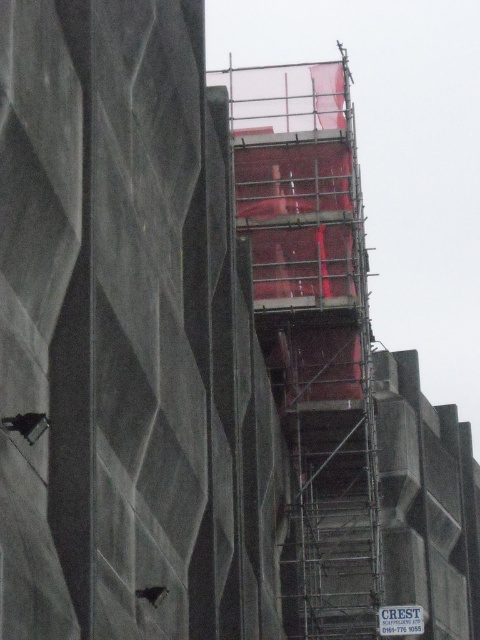
Question: Among these points, which one is nearest to the camera?

Choices:
 (A) (392, 609)
 (B) (279, 172)

Answer: (A)

Question: Which point is farther from the camera taking this photo?

Choices:
 (A) (265, 84)
 (B) (387, 630)

Answer: (A)

Question: Can you confirm if metallic scaffolding at center is positioned above blue plastic sign at upper center?

Choices:
 (A) yes
 (B) no

Answer: (A)

Question: Among these points, which one is farthest from the camera?

Choices:
 (A) (380, 632)
 (B) (288, 372)

Answer: (B)

Question: Is metallic scaffolding at center wider than blue plastic sign at upper center?

Choices:
 (A) no
 (B) yes

Answer: (B)

Question: Considering the relative positions of metallic scaffolding at center and blue plastic sign at upper center in the image provided, where is metallic scaffolding at center located with respect to blue plastic sign at upper center?

Choices:
 (A) above
 (B) below

Answer: (A)